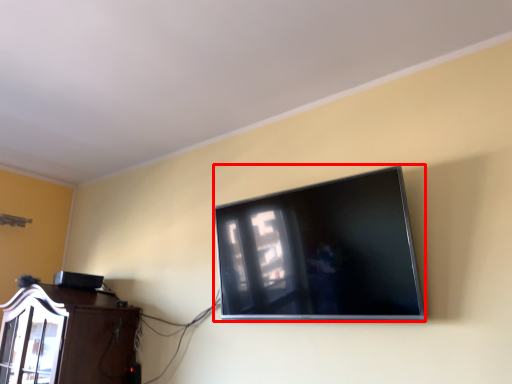
Question: From the image's perspective, where is television (annotated by the red box) located in relation to furniture in the image?

Choices:
 (A) below
 (B) above

Answer: (B)